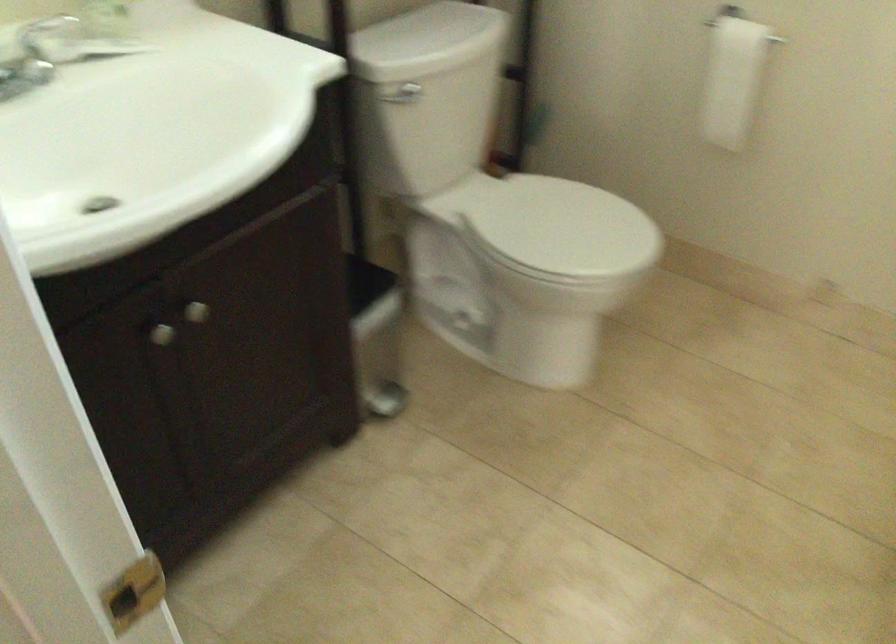
Based on the continuous images, in which direction is the camera rotating?

The rotation direction of the camera is left-down.